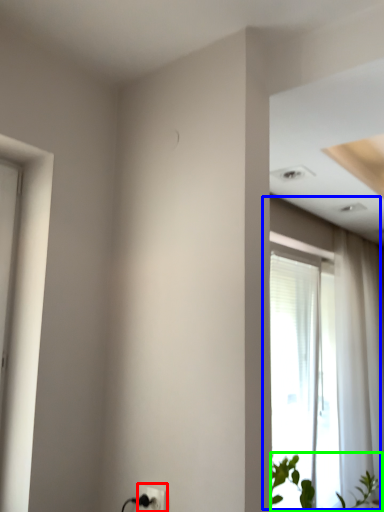
Question: Estimate the real-world distances between objects in this image. Which object is farther from electric outlet (highlighted by a red box), window (highlighted by a blue box) or houseplant (highlighted by a green box)?

Choices:
 (A) window
 (B) houseplant

Answer: (A)